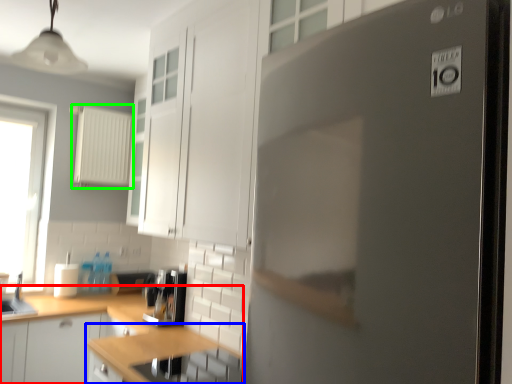
Question: Estimate the real-world distances between objects in this image. Which object is farther from cabinetry (highlighted by a red box), countertop (highlighted by a blue box) or appliance (highlighted by a green box)?

Choices:
 (A) countertop
 (B) appliance

Answer: (B)